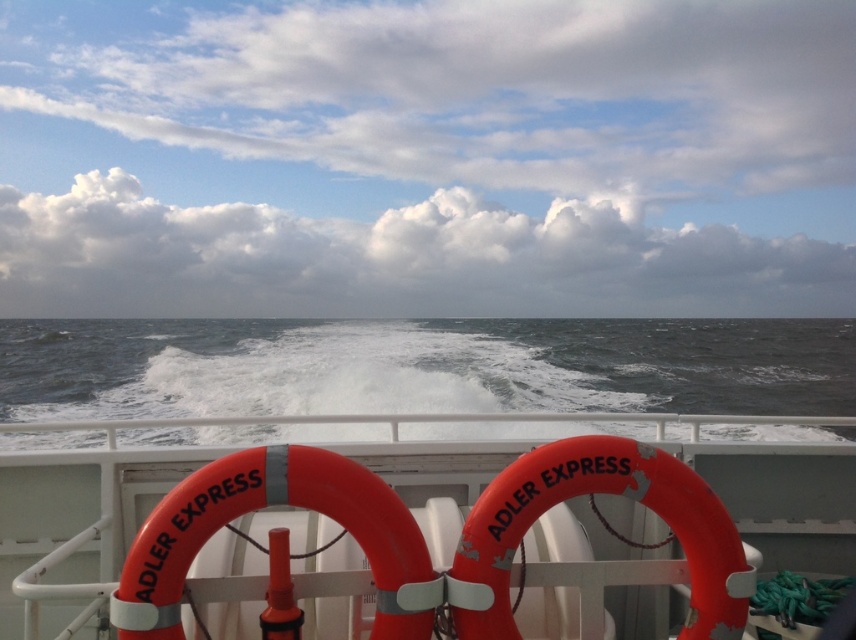
You are standing on the deck of the ferry and notice the dark gray water at center and the orange rubber life ring at center. Which object appears higher in your field of view?

The orange rubber life ring at center appears higher in the field of view because the dark gray water at center is taller than it, meaning the life ring is positioned lower relative to the observer.

You are standing on the deck of the Adler Express ferry and see a point marked at coordinates (395, 532). Which object is located at that position?

A: The point at coordinates (395, 532) corresponds to the orange rubber lifebuoy at center.

You are standing on the ferry deck and see the orange rubber lifebuoy at center and the orange rubber life ring at center. Which one is closer to you?

The orange rubber lifebuoy at center is closer to you because it is further to the viewer than the orange rubber life ring at center.